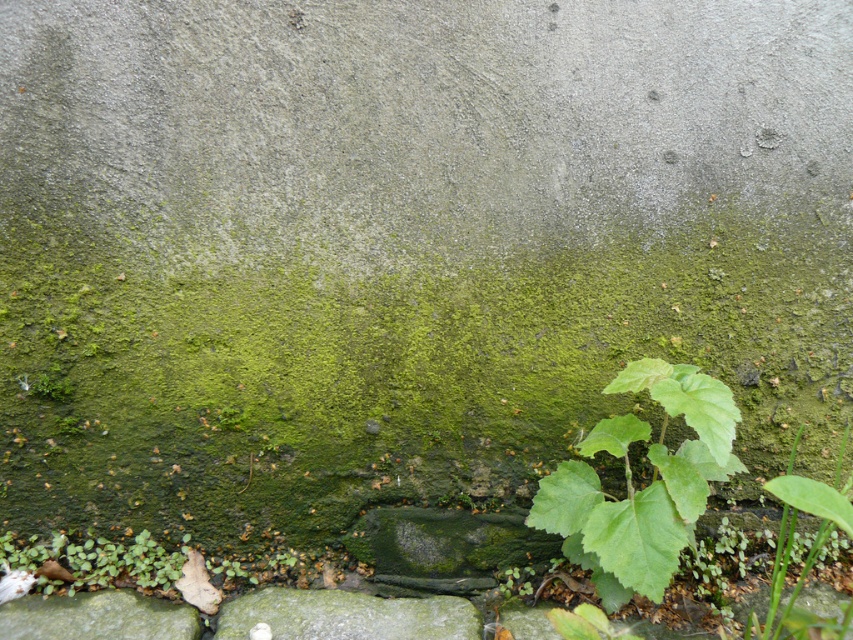
Based on the photo, you are a gardener trying to determine the space requirements for the green leafy plant at lower right and the green mossy concrete at lower center. Which one occupies more horizontal space?

The green mossy concrete at lower center might be wider than green leafy plant at lower right.

You are a gardener examining the wall. You need to place a small decorative stone between the green mossy concrete at lower center and the green leafy plant at lower right. Based on their positions, which object should the stone be placed closer to?

The stone should be placed closer to the green leafy plant at lower right because the green mossy concrete at lower center is positioned to the left of the green leafy plant at lower right.

You are a gardener examining the wall and notice the gray stone at lower center and the green mossy rock at lower left. Which object is located to the right of the other?

The gray stone at lower center is positioned on the right side of green mossy rock at lower left.